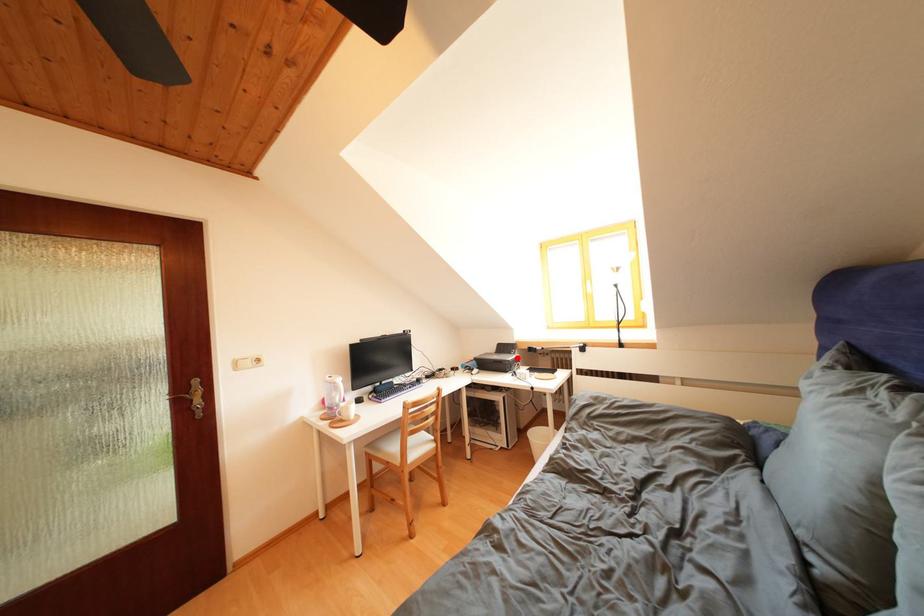
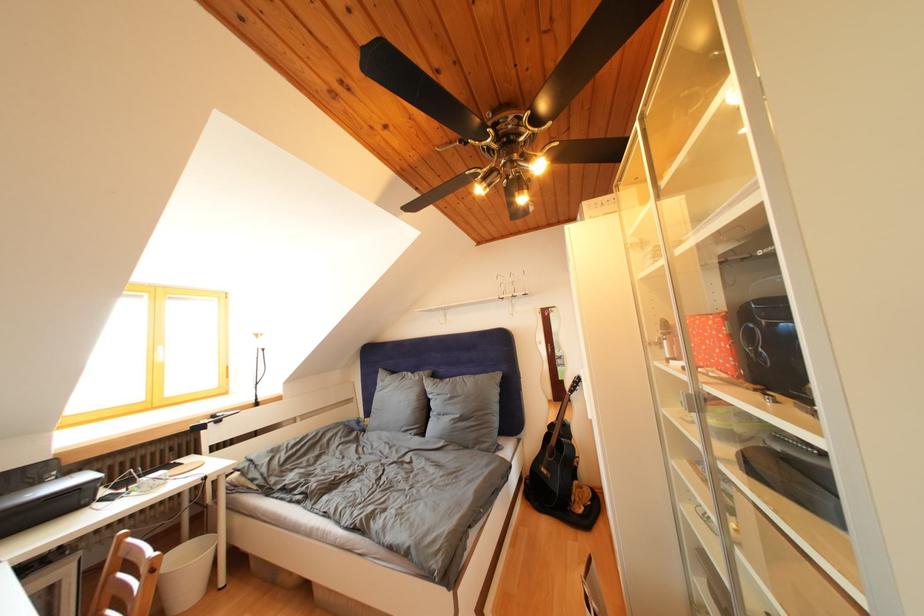
In the second image, find the point that corresponds to the highlighted location in the first image.

(44, 488)